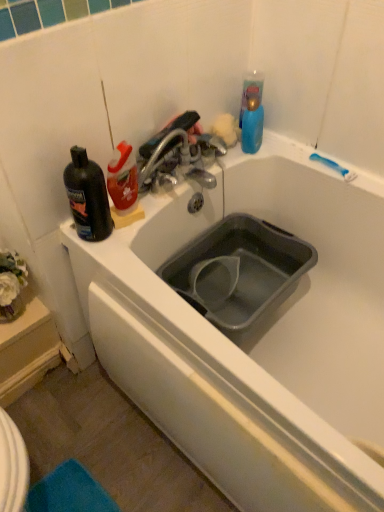
Question: In the image, is metallic silver faucet at upper center positioned in front of or behind black plastic bottle at upper left?

Choices:
 (A) behind
 (B) front

Answer: (A)

Question: Based on their sizes in the image, would you say metallic silver faucet at upper center is bigger or smaller than black plastic bottle at upper left?

Choices:
 (A) small
 (B) big

Answer: (B)

Question: Considering the real-world distances, which object is farthest from the black plastic bottle at upper left?

Choices:
 (A) metallic silver faucet at upper center
 (B) white matte bathtub at center
 (C) gray plastic sink at center

Answer: (B)

Question: Which object is positioned farthest from the white matte bathtub at center?

Choices:
 (A) gray plastic sink at center
 (B) black plastic bottle at upper left
 (C) metallic silver faucet at upper center

Answer: (B)